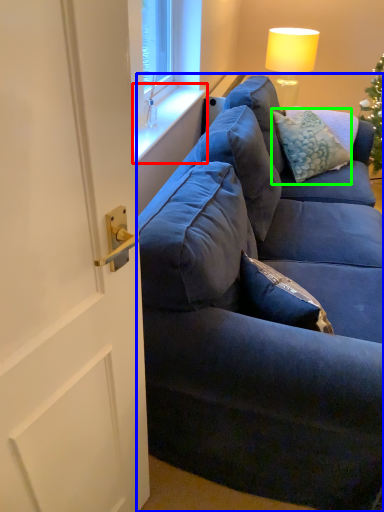
Question: Based on their relative distances, which object is farther from window sill (highlighted by a red box)? Choose from studio couch (highlighted by a blue box) and pillow (highlighted by a green box).

Choices:
 (A) studio couch
 (B) pillow

Answer: (A)